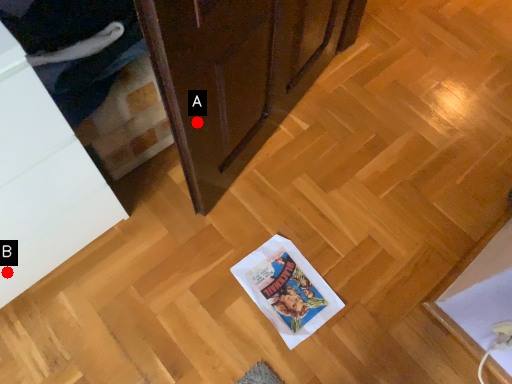
Question: Two points are circled on the image, labeled by A and B beside each circle. Which point is further to the camera?

Choices:
 (A) A is further
 (B) B is further

Answer: (B)